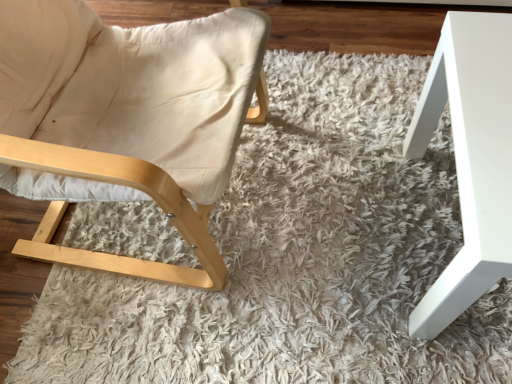
Locate an element on the screen. Image resolution: width=512 pixels, height=384 pixels. free space to the back side of white glossy table at right is located at coordinates (360, 117).